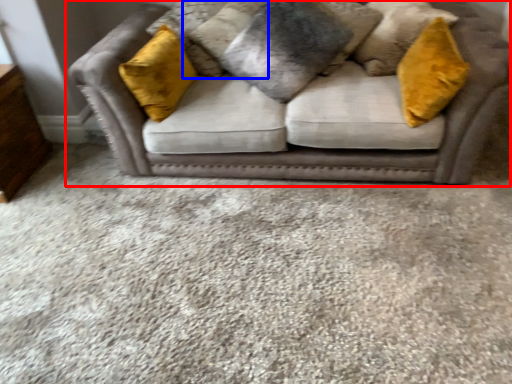
Question: Which object is further to the camera taking this photo, studio couch (highlighted by a red box) or pillow (highlighted by a blue box)?

Choices:
 (A) studio couch
 (B) pillow

Answer: (B)